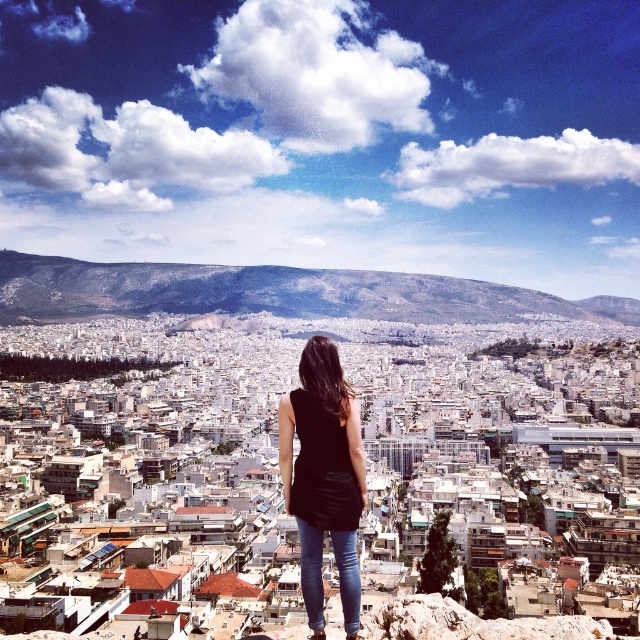
Question: Which point is farther to the camera?

Choices:
 (A) (371, 298)
 (B) (330, 401)
 (C) (337, 532)

Answer: (A)

Question: Can you confirm if gray rocky mountain at center is thinner than black matte tank top at center?

Choices:
 (A) yes
 (B) no

Answer: (B)

Question: Which object is closer to the camera taking this photo?

Choices:
 (A) jeans at center
 (B) gray rocky mountain at center
 (C) black matte tank top at center

Answer: (C)

Question: Considering the relative positions of gray rocky mountain at center and jeans at center in the image provided, where is gray rocky mountain at center located with respect to jeans at center?

Choices:
 (A) above
 (B) below

Answer: (A)

Question: Estimate the real-world distances between objects in this image. Which object is closer to the jeans at center?

Choices:
 (A) gray rocky mountain at center
 (B) black matte tank top at center

Answer: (B)

Question: Is gray rocky mountain at center smaller than black matte tank top at center?

Choices:
 (A) no
 (B) yes

Answer: (A)